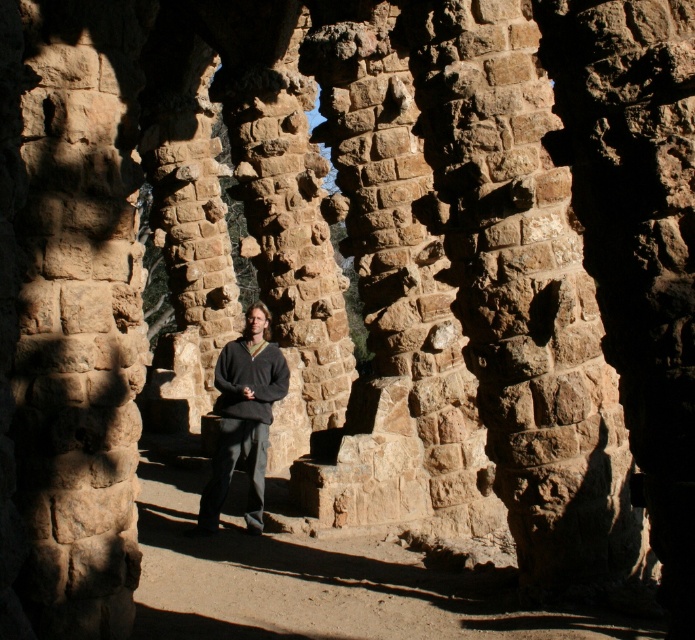
From the picture: Does dark gray sweater at center have a greater height compared to dark gray wool sweater at center?

Yes.

Who is more distant from viewer, (250,397) or (243,380)?

The point (243,380) is behind.

Where is `dark gray sweater at center`? dark gray sweater at center is located at coordinates (243, 417).